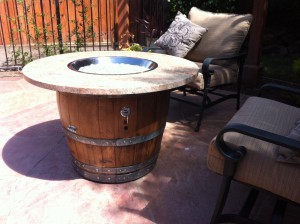
I want to click on pillow, so click(193, 36), click(226, 30), click(295, 135).